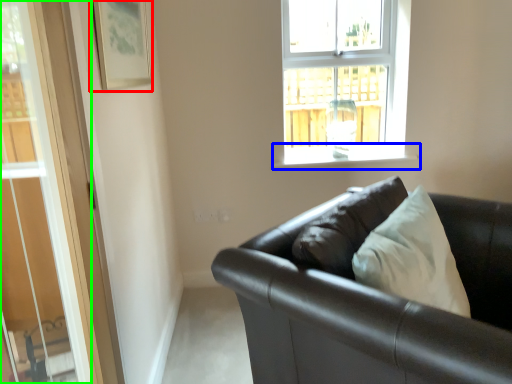
Question: Estimate the real-world distances between objects in this image. Which object is farther from picture frame (highlighted by a red box), window sill (highlighted by a blue box) or glass door (highlighted by a green box)?

Choices:
 (A) window sill
 (B) glass door

Answer: (A)